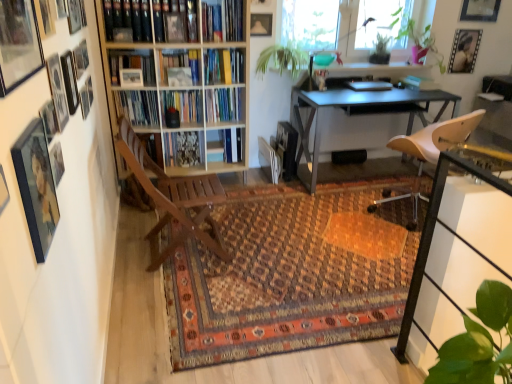
Find the location of a particular element. The width and height of the screenshot is (512, 384). metallic gray desk at center is located at coordinates (357, 113).

I want to click on metallic silver picture frame at upper left, the 7th picture frame viewed from the back, so click(70, 81).

Measure the distance between point (457, 53) and camera.

Point (457, 53) and camera are 3.97 meters apart.

Where is `matte black picture frame at upper right, acting as the 15th picture frame starting from the front`? matte black picture frame at upper right, acting as the 15th picture frame starting from the front is located at coordinates (464, 51).

How much space does green leafy plant at upper center, arranged as the third plant when viewed from the right, occupy vertically?

green leafy plant at upper center, arranged as the third plant when viewed from the right, is 17.22 inches tall.

Image resolution: width=512 pixels, height=384 pixels. I want to click on green leafy plant at upper center, which ranks as the first plant in left-to-right order, so (282, 59).

Locate an element on the screen. wooden picture frame at upper left, which is the 9th picture frame from left to right is located at coordinates click(18, 44).

Is matte black picture frame at upper right, acting as the 15th picture frame starting from the front, inside or outside of transparent glass window screen at upper center?

matte black picture frame at upper right, acting as the 15th picture frame starting from the front, is not enclosed by transparent glass window screen at upper center.

Which of these two, matte black picture frame at upper right, acting as the 15th picture frame starting from the front, or transparent glass window screen at upper center, is wider?

transparent glass window screen at upper center is wider.

From the image's perspective, which one is positioned higher, matte black picture frame at upper right, the 2th picture frame positioned from the right, or transparent glass window screen at upper center?

transparent glass window screen at upper center.

Is hardcover book at center, the 1th book from the bottom, a part of wooden picture frame at upper left, which ranks as the first picture frame in left-to-right order?

No, hardcover book at center, the 1th book from the bottom, is not a part of wooden picture frame at upper left, which ranks as the first picture frame in left-to-right order.

Is point (84, 14) positioned behind point (237, 104)?

No.

From the image's perspective, who appears lower, wooden picture frame at upper left, positioned as the 15th picture frame in right-to-left order, or hardcover book at center, which ranks as the 3th book in top-to-bottom order?

From the image's view, hardcover book at center, which ranks as the 3th book in top-to-bottom order, is below.

Would you consider wooden picture frame at upper left, the fifth picture frame in the back-to-front sequence, to be distant from hardcover book at center, which ranks as the 3th book in top-to-bottom order?

That's right, there is a large distance between wooden picture frame at upper left, the fifth picture frame in the back-to-front sequence, and hardcover book at center, which ranks as the 3th book in top-to-bottom order.

Is hardcover book at center, the 2th book viewed from the top, next to metallic silver picture frame at upper left, the ninth picture frame from the front?

No, hardcover book at center, the 2th book viewed from the top, is not touching metallic silver picture frame at upper left, the ninth picture frame from the front.

Is hardcover book at center, the 2th book viewed from the top, smaller than metallic silver picture frame at upper left, placed as the twelfth picture frame when sorted from right to left?

Actually, hardcover book at center, the 2th book viewed from the top, might be larger than metallic silver picture frame at upper left, placed as the twelfth picture frame when sorted from right to left.

Does hardcover book at center, the 2th book viewed from the top, appear on the left side of metallic silver picture frame at upper left, the ninth picture frame from the front?

No.

From the image's perspective, is wooden picture frame at upper left, the second picture frame from the left, below hardcover book at center, the 2th book in the bottom-to-top sequence?

Yes, from the image's perspective, wooden picture frame at upper left, the second picture frame from the left, is below hardcover book at center, the 2th book in the bottom-to-top sequence.

Who is smaller, wooden picture frame at upper left, the 6th picture frame viewed from the back, or hardcover book at center, the 2th book viewed from the top?

wooden picture frame at upper left, the 6th picture frame viewed from the back.

From a real-world perspective, which is physically below, wooden picture frame at upper left, placed as the 14th picture frame when sorted from right to left, or hardcover book at center, the 2th book in the bottom-to-top sequence?

From a 3D spatial view, hardcover book at center, the 2th book in the bottom-to-top sequence, is below.

From the picture: Between wooden picture frame at upper left, marked as the first picture frame in a front-to-back arrangement, and wooden picture frame at upper left, placed as the 14th picture frame when sorted from right to left, which one has smaller size?

wooden picture frame at upper left, marked as the first picture frame in a front-to-back arrangement, is smaller.

Is wooden picture frame at upper left, marked as the first picture frame in a front-to-back arrangement, in contact with wooden picture frame at upper left, the second picture frame from the left?

No, wooden picture frame at upper left, marked as the first picture frame in a front-to-back arrangement, is not with wooden picture frame at upper left, the second picture frame from the left.

From the image's perspective, which one is positioned lower, wooden picture frame at upper left, which is the 9th picture frame from left to right, or wooden picture frame at upper left, the second picture frame from the left?

wooden picture frame at upper left, which is the 9th picture frame from left to right, appears lower in the image.

Can you confirm if wooden picture frame at upper left, the 7th picture frame when ordered from right to left, is thinner than wooden picture frame at upper left, marked as the 10th picture frame in a front-to-back arrangement?

Yes.

Is matte black picture frame at upper left, which is the ninth picture frame from right to left, taller or shorter than matte black picture frame at upper right, the 2th picture frame positioned from the right?

matte black picture frame at upper left, which is the ninth picture frame from right to left, is shorter than matte black picture frame at upper right, the 2th picture frame positioned from the right.

Consider the image. Is matte black picture frame at upper left, which ranks as the tenth picture frame in back-to-front order, directly adjacent to matte black picture frame at upper right, acting as the 15th picture frame starting from the front?

matte black picture frame at upper left, which ranks as the tenth picture frame in back-to-front order, and matte black picture frame at upper right, acting as the 15th picture frame starting from the front, are clearly separated.

From a real-world perspective, which is physically above, matte black picture frame at upper left, which is the ninth picture frame from right to left, or matte black picture frame at upper right, which ranks as the first picture frame in back-to-front order?

From a 3D spatial view, matte black picture frame at upper right, which ranks as the first picture frame in back-to-front order, is above.

At what (x,y) coordinates should I click in order to perform the action: click on picture frame that is the 9th object located above the matte black picture frame at upper left, which ranks as the tenth picture frame in back-to-front order (from the image's perspective). Please return your answer as a coordinate pair (x, y). The image size is (512, 384). Looking at the image, I should click on (464, 51).

Can we say matte glass picture frame at upper left, placed as the thirteenth picture frame when sorted from back to front, lies outside wooden picture frame at upper left, the 6th picture frame viewed from the left?

That's correct, matte glass picture frame at upper left, placed as the thirteenth picture frame when sorted from back to front, is outside of wooden picture frame at upper left, the 6th picture frame viewed from the left.

Is matte glass picture frame at upper left, which is the tenth picture frame in left-to-right order, bigger than wooden picture frame at upper left, arranged as the fourth picture frame when viewed from the front?

Yes.

Is matte glass picture frame at upper left, placed as the 3th picture frame when sorted from front to back, oriented towards wooden picture frame at upper left, the 12th picture frame positioned from the back?

No, matte glass picture frame at upper left, placed as the 3th picture frame when sorted from front to back, is not aimed at wooden picture frame at upper left, the 12th picture frame positioned from the back.

Can you see matte glass picture frame at upper left, acting as the sixth picture frame starting from the right, touching wooden picture frame at upper left, the 12th picture frame positioned from the back?

No, matte glass picture frame at upper left, acting as the sixth picture frame starting from the right, is not next to wooden picture frame at upper left, the 12th picture frame positioned from the back.

Where is `window screen above the matte black picture frame at upper right, the 2th picture frame positioned from the right (from the image's perspective)`? This screenshot has width=512, height=384. window screen above the matte black picture frame at upper right, the 2th picture frame positioned from the right (from the image's perspective) is located at coordinates (337, 22).

Find the location of a particular element. This screenshot has width=512, height=384. book that is the 3rd one when counting backward from the wooden picture frame at upper left, arranged as the 11th picture frame when viewed from the front is located at coordinates (224, 104).

From the image, which object appears to be farther from wooden picture frame at upper left, the fifth picture frame in the back-to-front sequence, matte black picture frame at left, the fifth picture frame from the right, or hardcover book at center, the 2th book in the bottom-to-top sequence?

Among the two, matte black picture frame at left, the fifth picture frame from the right, is located further to wooden picture frame at upper left, the fifth picture frame in the back-to-front sequence.

Which object lies further to the anchor point white leather chair at center, placed as the 1th chair when sorted from right to left, transparent glass window screen at upper center or hardcover book at upper center, which is the 3th book in bottom-to-top order?

hardcover book at upper center, which is the 3th book in bottom-to-top order, is further to white leather chair at center, placed as the 1th chair when sorted from right to left.

Considering their positions, is wooden picture frame at upper left, marked as the 10th picture frame in a right-to-left arrangement, positioned closer to white leather chair at center, placed as the 1th chair when sorted from right to left, than green leafy plant at upper right, marked as the 2th plant in a left-to-right arrangement?

green leafy plant at upper right, marked as the 2th plant in a left-to-right arrangement, lies closer to white leather chair at center, placed as the 1th chair when sorted from right to left, than the other object.

Considering their positions, is wooden picture frame at upper left, placed as the 14th picture frame when sorted from right to left, positioned closer to green leafy plant at upper right, the 2th plant positioned from the right, than green leafy plant at upper right, the 1th plant viewed from the right?

green leafy plant at upper right, the 1th plant viewed from the right, lies closer to green leafy plant at upper right, the 2th plant positioned from the right, than the other object.

Considering their positions, is matte black picture frame at upper left, which is the 9th picture frame from back to front, positioned further to white leather chair at center, the 2th chair when ordered from left to right, than matte black picture frame at upper left, which ranks as the tenth picture frame in back-to-front order?

The object further to white leather chair at center, the 2th chair when ordered from left to right, is matte black picture frame at upper left, which ranks as the tenth picture frame in back-to-front order.

From the image, which object appears to be nearer to hardcover book at upper center, which is the 3th book in bottom-to-top order, wooden picture frame at upper right, which appears as the 14th picture frame when viewed from the front, or matte glass picture frame at upper left, placed as the thirteenth picture frame when sorted from back to front?

wooden picture frame at upper right, which appears as the 14th picture frame when viewed from the front.

In the scene shown: Estimate the real-world distances between objects in this image. Which object is further from metallic gray desk at center, matte black picture frame at upper left, which is the eleventh picture frame in right-to-left order, or matte black picture frame at upper center, the twelfth picture frame when ordered from front to back?

matte black picture frame at upper left, which is the eleventh picture frame in right-to-left order.

Estimate the real-world distances between objects in this image. Which object is closer to matte black picture frame at upper right, the 2th picture frame positioned from the right, green leafy plant at upper center, arranged as the third plant when viewed from the right, or wooden picture frame at upper left, which is the 11th picture frame from back to front?

Among the two, green leafy plant at upper center, arranged as the third plant when viewed from the right, is located nearer to matte black picture frame at upper right, the 2th picture frame positioned from the right.

Where is `mat positioned between metallic silver table at center and wooden picture frame at upper right, which appears as the 14th picture frame when viewed from the front, from near to far`? This screenshot has width=512, height=384. mat positioned between metallic silver table at center and wooden picture frame at upper right, which appears as the 14th picture frame when viewed from the front, from near to far is located at coordinates point(291,274).

Where is `desk between wooden picture frame at upper left, marked as the 10th picture frame in a front-to-back arrangement, and green leafy plant at upper right, marked as the 2th plant in a left-to-right arrangement, in the horizontal direction`? The height and width of the screenshot is (384, 512). desk between wooden picture frame at upper left, marked as the 10th picture frame in a front-to-back arrangement, and green leafy plant at upper right, marked as the 2th plant in a left-to-right arrangement, in the horizontal direction is located at coordinates (357, 113).

Where is `picture frame between wooden picture frame at upper left, which ranks as the first picture frame in left-to-right order, and hardcover book at center, the 1th book from the bottom, from front to back`? The image size is (512, 384). picture frame between wooden picture frame at upper left, which ranks as the first picture frame in left-to-right order, and hardcover book at center, the 1th book from the bottom, from front to back is located at coordinates (x=261, y=3).

Locate an element on the screen. This screenshot has height=384, width=512. window screen located between matte black picture frame at upper left, the 7th picture frame when ordered from left to right, and green leafy plant at upper right, the 1th plant viewed from the right, in the depth direction is located at coordinates (337, 22).